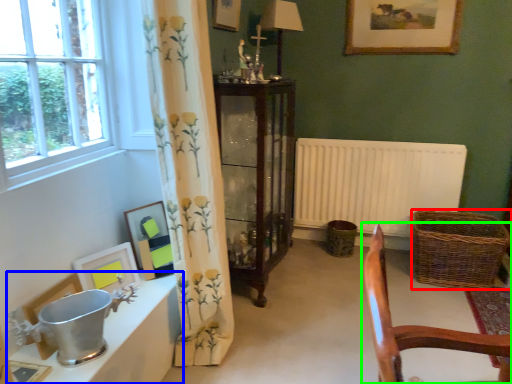
Question: Which is farther away from basket (highlighted by a red box)? table (highlighted by a blue box) or chair (highlighted by a green box)?

Choices:
 (A) table
 (B) chair

Answer: (A)